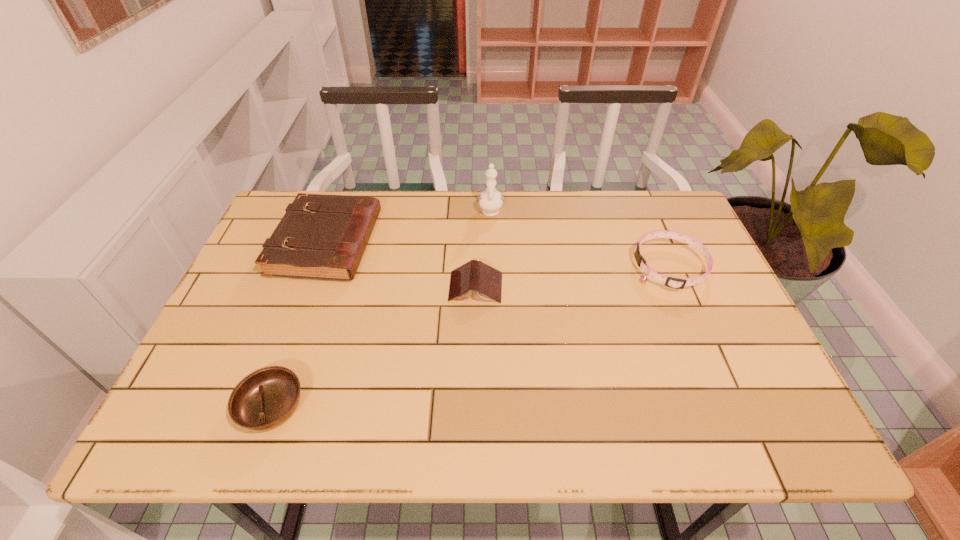
At what (x,y) coordinates should I click in order to perform the action: click on the tallest object. Please return your answer as a coordinate pair (x, y). The height and width of the screenshot is (540, 960). Looking at the image, I should click on (490, 201).

Where is `the fourth shortest object`? the fourth shortest object is located at coordinates (324, 237).

You are a GUI agent. You are given a task and a screenshot of the screen. Output one action in this format:
    pyautogui.click(x=<x>, y=<y>)
    Task: Click on the rightmost object
    The width and height of the screenshot is (960, 540).
    Given the screenshot: What is the action you would take?
    pyautogui.click(x=677, y=283)

Identify the location of book. [x=485, y=282].

Locate an element on the screen. This screenshot has width=960, height=540. soup bowl is located at coordinates (266, 398).

This screenshot has width=960, height=540. Identify the location of blank space located 0.140m on the right of the second tallest object. (423, 243).

Find the location of a particular element. The width and height of the screenshot is (960, 540). vacant space located 0.190m with the buckle on the dog collar is located at coordinates (564, 267).

Where is `vacant space located with the buckle on the dog collar`? Image resolution: width=960 pixels, height=540 pixels. vacant space located with the buckle on the dog collar is located at coordinates (608, 267).

At what (x,y) coordinates should I click in order to perform the action: click on free space located with the buckle on the dog collar. Please return your answer as a coordinate pair (x, y). Looking at the image, I should click on (615, 267).

At what (x,y) coordinates should I click in order to perform the action: click on vacant space located 0.380m on the right of the book. Please return your answer as a coordinate pair (x, y). The height and width of the screenshot is (540, 960). Looking at the image, I should click on (649, 287).